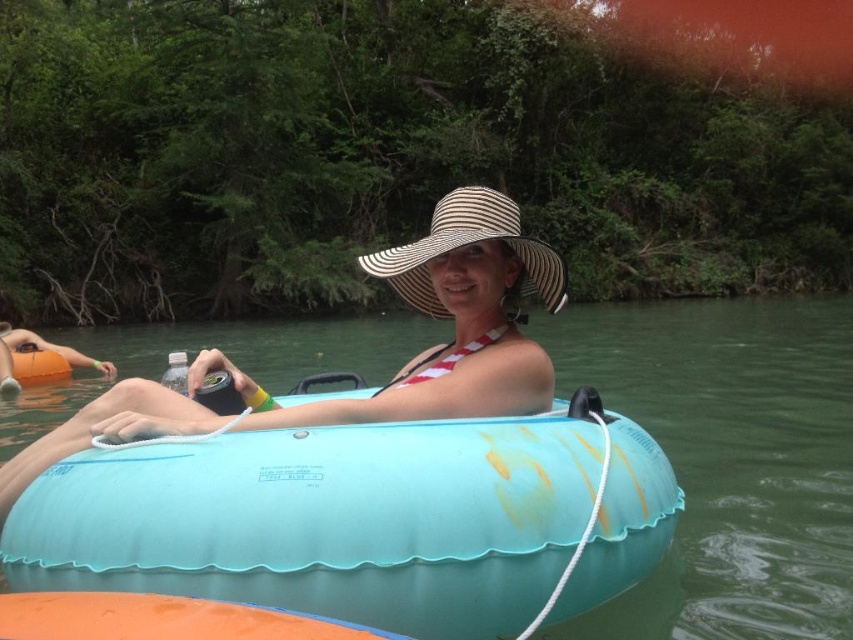
You are a photographer trying to capture the light blue rubber ring at center and the white striped straw hat at center in the same frame. Which object should you focus on first if you want to ensure both are in focus without moving the camera?

The light blue rubber ring at center is smaller than the white striped straw hat at center, so you should focus on the white striped straw hat at center first to ensure both are in focus.